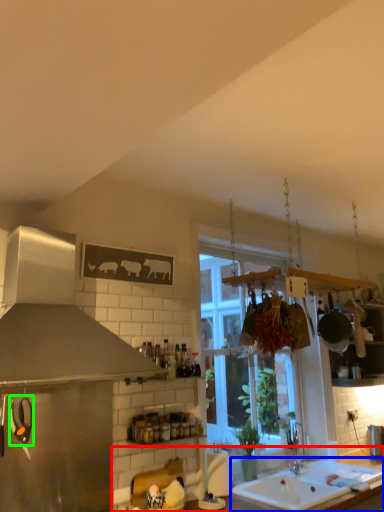
Question: Which is nearer to the countertop (highlighted by a red box)? sink (highlighted by a blue box) or appliance (highlighted by a green box).

Choices:
 (A) sink
 (B) appliance

Answer: (A)